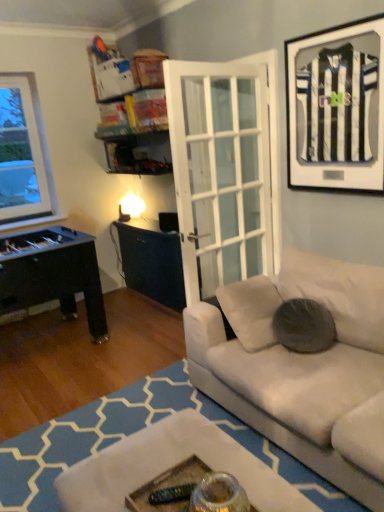
This screenshot has height=512, width=384. I want to click on matte black jersey at upper right, so (336, 108).

Describe the element at coordinates (336, 108) in the screenshot. I see `matte black jersey at upper right` at that location.

Describe the element at coordinates (304, 326) in the screenshot. I see `dark gray fabric pillow at center` at that location.

Identify the location of dark gray fabric pillow at center. (304, 326).

The image size is (384, 512). I want to click on matte black jersey at upper right, so click(x=336, y=108).

Which object is positioned more to the right, dark gray fabric pillow at center or matte black jersey at upper right?

matte black jersey at upper right is more to the right.

Between dark gray fabric pillow at center and matte black jersey at upper right, which one is positioned behind?

dark gray fabric pillow at center is further away from the camera.

Is point (319, 315) positioned behind point (370, 105)?

Yes, point (319, 315) is behind point (370, 105).

From the image's perspective, which is below, dark gray fabric pillow at center or matte black jersey at upper right?

dark gray fabric pillow at center.

From a real-world perspective, is dark gray fabric pillow at center physically located above or below matte black jersey at upper right?

In terms of real-world spatial position, dark gray fabric pillow at center is below matte black jersey at upper right.

Can you confirm if dark gray fabric pillow at center is wider than matte black jersey at upper right?

Yes.

Is dark gray fabric pillow at center shorter than matte black jersey at upper right?

Correct, dark gray fabric pillow at center is not as tall as matte black jersey at upper right.

Who is smaller, dark gray fabric pillow at center or matte black jersey at upper right?

With smaller size is matte black jersey at upper right.

Which is correct: dark gray fabric pillow at center is inside matte black jersey at upper right, or outside of it?

dark gray fabric pillow at center is spatially situated outside matte black jersey at upper right.

Is dark gray fabric pillow at center far away from matte black jersey at upper right?

Indeed, dark gray fabric pillow at center is not near matte black jersey at upper right.

Is dark gray fabric pillow at center looking in the opposite direction of matte black jersey at upper right?

That's not correct — dark gray fabric pillow at center is not looking away from matte black jersey at upper right.

How different are the orientations of dark gray fabric pillow at center and matte black jersey at upper right in degrees?

The angular difference between dark gray fabric pillow at center and matte black jersey at upper right is 64 degrees.

The width and height of the screenshot is (384, 512). In the image, there is a dark gray fabric pillow at center. Identify the location of picture frame above it (from the image's perspective). (336, 108).

Does matte black jersey at upper right appear on the left side of dark gray fabric pillow at center?

No, matte black jersey at upper right is not to the left of dark gray fabric pillow at center.

Does matte black jersey at upper right lie behind dark gray fabric pillow at center?

No, matte black jersey at upper right is in front of dark gray fabric pillow at center.

Considering the points (341, 73) and (334, 325), which point is behind, point (341, 73) or point (334, 325)?

Positioned behind is point (334, 325).

From the image's perspective, which is below, matte black jersey at upper right or dark gray fabric pillow at center?

dark gray fabric pillow at center, from the image's perspective.

From a real-world perspective, is matte black jersey at upper right on top of dark gray fabric pillow at center?

Yes, from a real-world perspective, matte black jersey at upper right is over dark gray fabric pillow at center

Does matte black jersey at upper right have a lesser width compared to dark gray fabric pillow at center?

Indeed, matte black jersey at upper right has a lesser width compared to dark gray fabric pillow at center.

Does matte black jersey at upper right have a greater height compared to dark gray fabric pillow at center?

Yes, matte black jersey at upper right is taller than dark gray fabric pillow at center.

Considering the sizes of objects matte black jersey at upper right and dark gray fabric pillow at center in the image provided, who is smaller, matte black jersey at upper right or dark gray fabric pillow at center?

matte black jersey at upper right is smaller.

Would you say matte black jersey at upper right is outside dark gray fabric pillow at center?

That's correct, matte black jersey at upper right is outside of dark gray fabric pillow at center.

Is the surface of matte black jersey at upper right in direct contact with dark gray fabric pillow at center?

No, matte black jersey at upper right is not making contact with dark gray fabric pillow at center.

Is matte black jersey at upper right looking in the opposite direction of dark gray fabric pillow at center?

No, matte black jersey at upper right is not facing away from dark gray fabric pillow at center.

Identify the location of picture frame on the right of dark gray fabric pillow at center. (336, 108).

You are a GUI agent. You are given a task and a screenshot of the screen. Output one action in this format:
    pyautogui.click(x=<x>, y=<y>)
    Task: Click on the pillow below the matte black jersey at upper right (from a real-world perspective)
    This screenshot has width=384, height=512.
    Given the screenshot: What is the action you would take?
    (304, 326)

Find the location of a particular element. The width and height of the screenshot is (384, 512). pillow lying behind the matte black jersey at upper right is located at coordinates (304, 326).